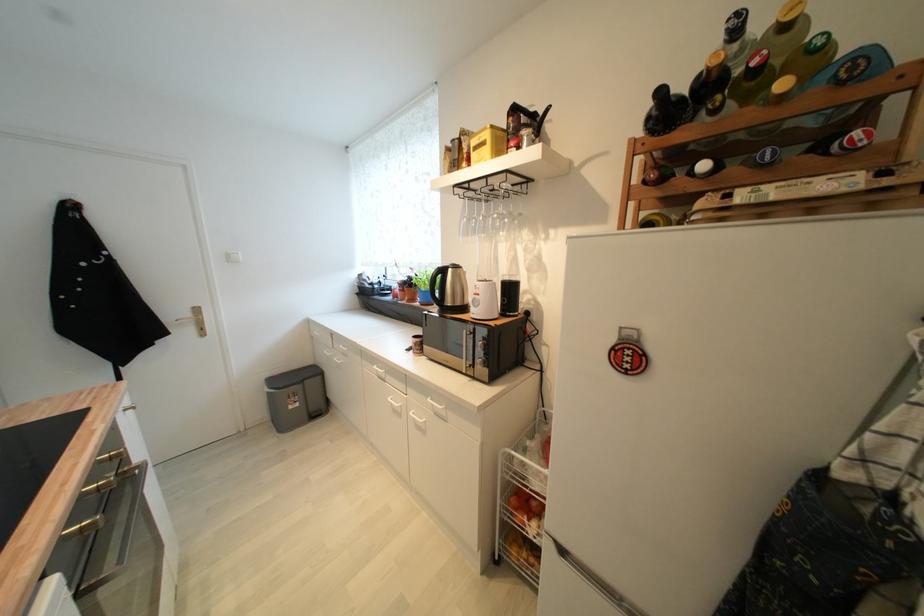
Locate an element on the screen. This screenshot has width=924, height=616. silver kettle handle is located at coordinates (525, 120).